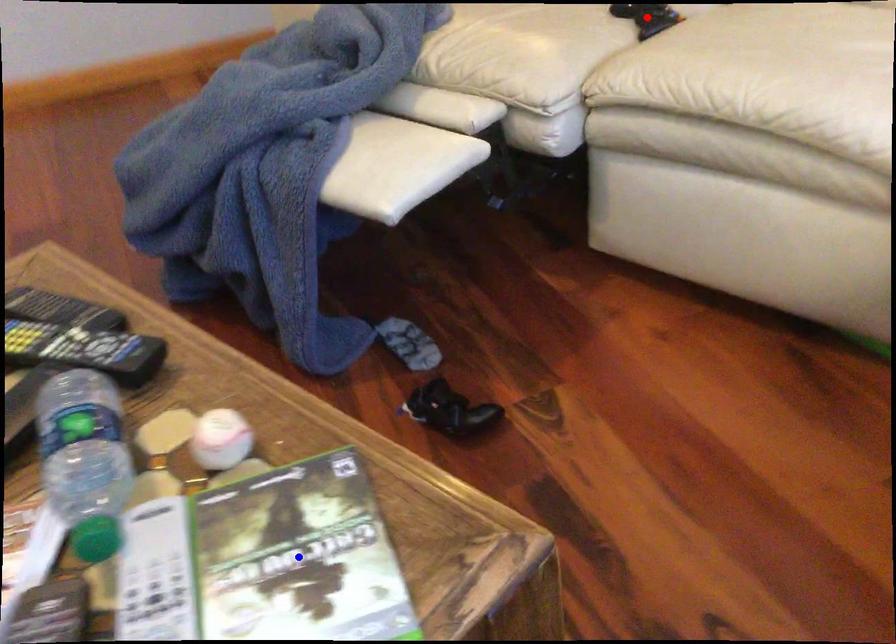
Question: Which of the two points in the image is closer to the camera?

Choices:
 (A) Blue point is closer.
 (B) Red point is closer.

Answer: (A)